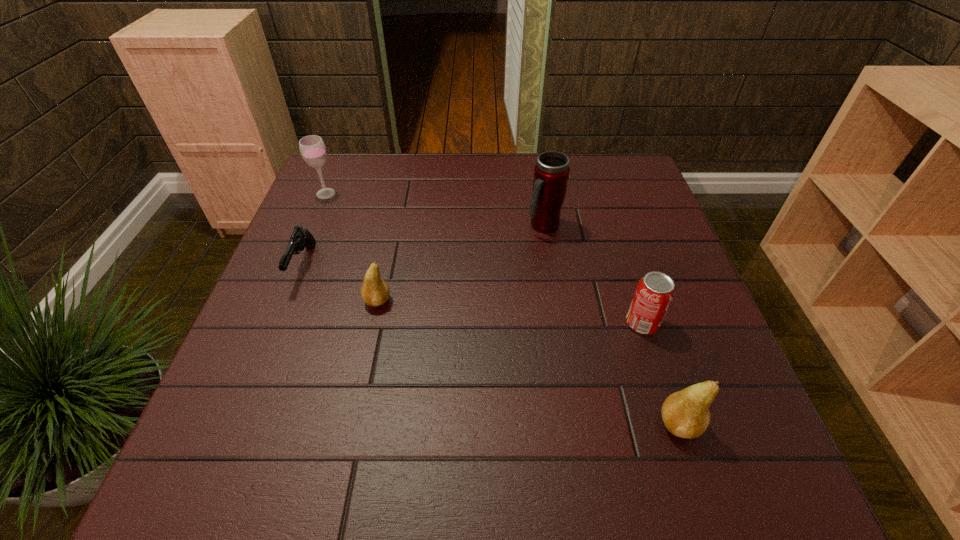
Find the location of `free point between the fifth shortest object and the soda can`. free point between the fifth shortest object and the soda can is located at coordinates (484, 258).

This screenshot has height=540, width=960. I want to click on vacant space in between the soda can and the nearest object, so click(x=660, y=374).

Identify the location of unoccupied area between the fifth nearest object and the wineglass. (435, 210).

Image resolution: width=960 pixels, height=540 pixels. What are the coordinates of `free space between the farther pear and the fifth nearest object` in the screenshot? It's located at (461, 264).

Identify the location of empty space that is in between the soda can and the fourth object from left to right. This screenshot has width=960, height=540. (593, 274).

This screenshot has height=540, width=960. What are the coordinates of `vacant area between the second tallest object and the shortest object` in the screenshot? It's located at pos(315,230).

Where is `empty location between the soda can and the fifth nearest object`? empty location between the soda can and the fifth nearest object is located at coordinates (593, 274).

The image size is (960, 540). What are the coordinates of `free spot between the wineglass and the soda can` in the screenshot? It's located at (484, 258).

The height and width of the screenshot is (540, 960). Identify the location of vacant area that lies between the shortest object and the second tallest object. (315, 230).

You are a GUI agent. You are given a task and a screenshot of the screen. Output one action in this format:
    pyautogui.click(x=<x>, y=<y>)
    Task: Click on the fourth closest object to the gun
    
    Given the screenshot: What is the action you would take?
    pyautogui.click(x=655, y=291)